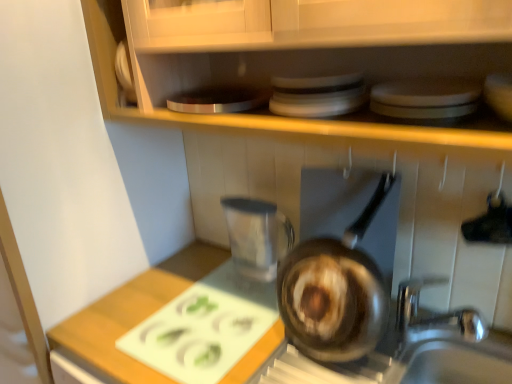
What do you see at coordinates (336, 291) in the screenshot? The height and width of the screenshot is (384, 512). I see `shiny brown frying pan at center` at bounding box center [336, 291].

Where is `white cutting board at center`? white cutting board at center is located at coordinates (133, 312).

Considering the sizes of objects white cutting board at center and white glossy plates at upper center in the image provided, who is thinner, white cutting board at center or white glossy plates at upper center?

white glossy plates at upper center.

From a real-world perspective, who is located higher, white cutting board at center or white glossy plates at upper center?

In real-world perspective, white glossy plates at upper center is above.

Is white cutting board at center to the right of white glossy plates at upper center from the viewer's perspective?

No.

How different are the orientations of white cutting board at center and white glossy plates at upper center in degrees?

0.954 degrees.

Is white glossy plates at upper center bigger or smaller than white cutting board at center?

Considering their sizes, white glossy plates at upper center takes up less space than white cutting board at center.

Which object is positioned more to the right, white glossy plates at upper center or white cutting board at center?

white glossy plates at upper center is more to the right.

There is a white cutting board at center. Where is `appliance above it (from a real-world perspective)`? The image size is (512, 384). appliance above it (from a real-world perspective) is located at coordinates (317, 95).

Is white glossy plates at upper center closer to camera compared to white cutting board at center?

Yes.

Is white cutting board at center located outside shiny brown frying pan at center?

white cutting board at center is positioned outside shiny brown frying pan at center.

From their relative heights in the image, would you say white cutting board at center is taller or shorter than shiny brown frying pan at center?

white cutting board at center is shorter than shiny brown frying pan at center.

From a real-world perspective, is white cutting board at center above or below shiny brown frying pan at center?

From a real-world perspective, white cutting board at center is physically below shiny brown frying pan at center.

Visually, is white cutting board at center positioned to the left or to the right of shiny brown frying pan at center?

In the image, white cutting board at center appears on the left side of shiny brown frying pan at center.

Locate an element on the screen. appliance in front of the shiny brown frying pan at center is located at coordinates (317, 95).

Is white glossy plates at upper center in contact with shiny brown frying pan at center?

No, white glossy plates at upper center is not making contact with shiny brown frying pan at center.

From a real-world perspective, is white glossy plates at upper center on shiny brown frying pan at center?

Indeed, from a real-world perspective, white glossy plates at upper center stands above shiny brown frying pan at center.

Is shiny brown frying pan at center at the back of white glossy plates at upper center?

No, white glossy plates at upper center is not facing away from shiny brown frying pan at center.

From a real-world perspective, which is physically below, shiny brown frying pan at center or white cutting board at center?

white cutting board at center is physically lower.

Image resolution: width=512 pixels, height=384 pixels. I want to click on counter top lying in front of the shiny brown frying pan at center, so click(133, 312).

Does point (339, 335) lie behind point (152, 278)?

No, it is in front of (152, 278).

Can you tell me how much shiny brown frying pan at center and white cutting board at center differ in facing direction?

They differ by 20 degrees in their facing directions.

Can you confirm if shiny brown frying pan at center is positioned to the left of white glossy plates at upper center?

No.

From a real-world perspective, is shiny brown frying pan at center above or below white glossy plates at upper center?

In terms of real-world spatial position, shiny brown frying pan at center is below white glossy plates at upper center.

Is shiny brown frying pan at center in front of white glossy plates at upper center?

No, shiny brown frying pan at center is further to the viewer.

This screenshot has width=512, height=384. What are the coordinates of `appliance that is in front of the shiny brown frying pan at center` in the screenshot? It's located at (317, 95).

At what (x,y) coordinates should I click in order to perform the action: click on appliance located in front of the white cutting board at center. Please return your answer as a coordinate pair (x, y). This screenshot has height=384, width=512. Looking at the image, I should click on (317, 95).

Find the location of `appliance to the right of white cutting board at center`. appliance to the right of white cutting board at center is located at coordinates (317, 95).

Which object lies nearer to the anchor point white glossy plates at upper center, white cutting board at center or shiny brown frying pan at center?

shiny brown frying pan at center.

Based on their spatial positions, is shiny brown frying pan at center or white glossy plates at upper center closer to white cutting board at center?

Among the two, shiny brown frying pan at center is located nearer to white cutting board at center.

Estimate the real-world distances between objects in this image. Which object is further from shiny brown frying pan at center, white glossy plates at upper center or white cutting board at center?

The object further to shiny brown frying pan at center is white glossy plates at upper center.

Estimate the real-world distances between objects in this image. Which object is further from white cutting board at center, white glossy plates at upper center or shiny brown frying pan at center?

white glossy plates at upper center is further to white cutting board at center.

Estimate the real-world distances between objects in this image. Which object is further from shiny brown frying pan at center, white cutting board at center or white glossy plates at upper center?

The object further to shiny brown frying pan at center is white glossy plates at upper center.

When comparing their distances from white glossy plates at upper center, does shiny brown frying pan at center or white cutting board at center seem further?

white cutting board at center is positioned further to the anchor white glossy plates at upper center.

At what (x,y) coordinates should I click in order to perform the action: click on frying pan between white glossy plates at upper center and white cutting board at center vertically. Please return your answer as a coordinate pair (x, y). The image size is (512, 384). Looking at the image, I should click on (336, 291).